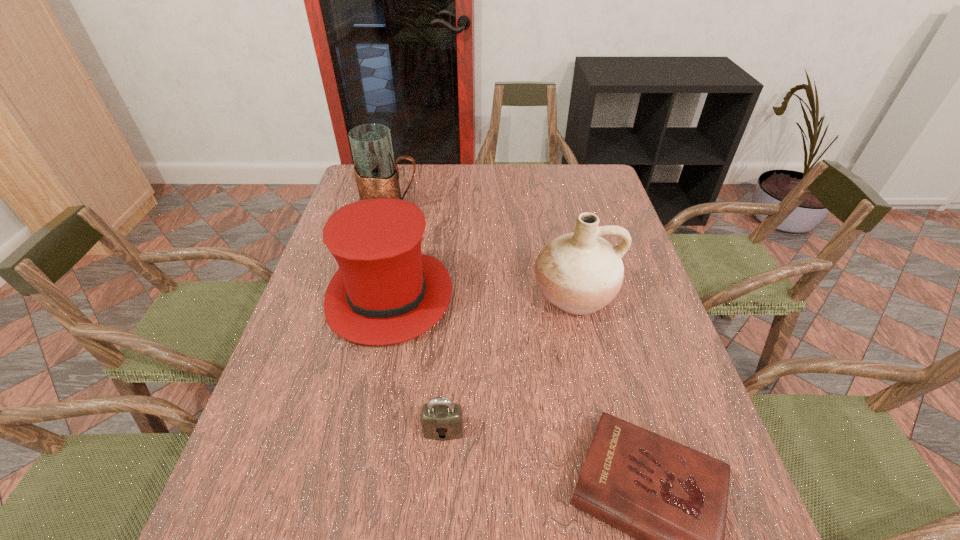
The image size is (960, 540). Identify the location of pitcher. (377, 176).

Locate an element on the screen. This screenshot has width=960, height=540. pottery is located at coordinates (580, 273).

Where is `hat`? The height and width of the screenshot is (540, 960). hat is located at coordinates (385, 291).

You are a GUI agent. You are given a task and a screenshot of the screen. Output one action in this format:
    pyautogui.click(x=<x>, y=<y>)
    Task: Click on the fourth tallest object
    The width and height of the screenshot is (960, 540).
    Given the screenshot: What is the action you would take?
    pyautogui.click(x=441, y=419)

Where is `free space located 0.090m with the handle on the side of the pitcher`? free space located 0.090m with the handle on the side of the pitcher is located at coordinates (447, 211).

Find the location of a particular element. The height and width of the screenshot is (540, 960). free location located to pour from the handle of the pottery is located at coordinates (590, 370).

This screenshot has height=540, width=960. Find the location of `free space located 0.180m on the back of the hat`. free space located 0.180m on the back of the hat is located at coordinates (406, 219).

Locate an element on the screen. This screenshot has width=960, height=540. vacant space located 0.150m at the front of the padlock near the keyhole is located at coordinates (437, 523).

Locate an element on the screen. This screenshot has width=960, height=540. object at the far edge is located at coordinates (377, 176).

The width and height of the screenshot is (960, 540). I want to click on pitcher that is at the left edge, so click(377, 176).